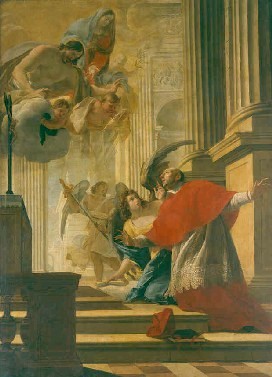
Find the location of `stairs`. stairs is located at coordinates (112, 343).